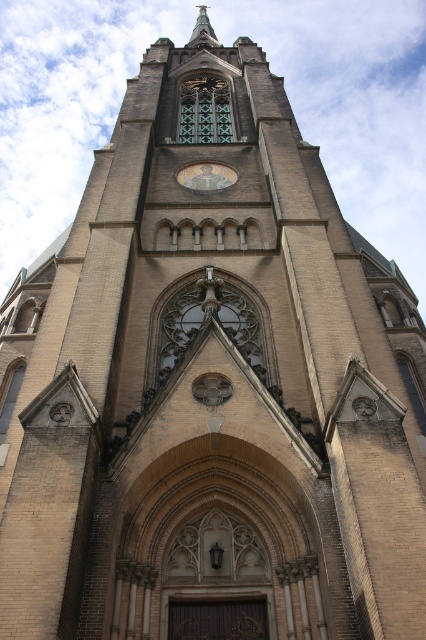
Can you confirm if gold metallic clock at center is taller than polished gold spire at upper center?

In fact, gold metallic clock at center may be shorter than polished gold spire at upper center.

Does gold metallic clock at center have a greater width compared to polished gold spire at upper center?

No.

In order to click on gold metallic clock at center in this screenshot , I will do [x=207, y=177].